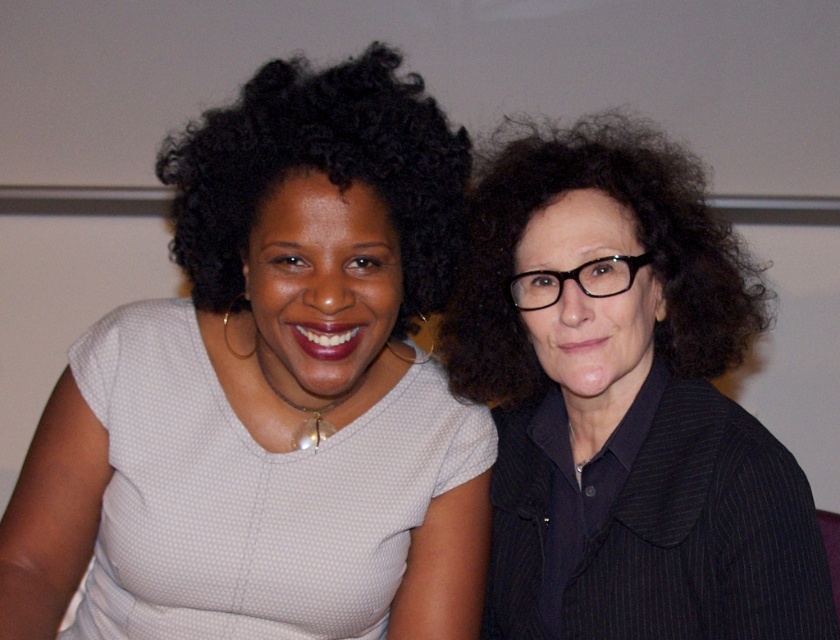
Is matte white blouse at center further to the viewer compared to black pinstriped blazer at right?

No, matte white blouse at center is in front of black pinstriped blazer at right.

Which is in front, point (403, 106) or point (722, 404)?

Point (403, 106) is in front.

At what (x,y) coordinates should I click in order to perform the action: click on matte white blouse at center. Please return your answer as a coordinate pair (x, y). The image size is (840, 640). Looking at the image, I should click on (271, 394).

Who is positioned more to the left, curly dark brown hair at right or black curly hair at upper left?

black curly hair at upper left

Can you confirm if curly dark brown hair at right is smaller than black curly hair at upper left?

No.

The width and height of the screenshot is (840, 640). Find the location of `curly dark brown hair at right`. curly dark brown hair at right is located at coordinates (638, 237).

Is matte white blouse at center behind black curly hair at upper left?

Yes, it is behind black curly hair at upper left.

Between matte white blouse at center and black curly hair at upper left, which one appears on the right side from the viewer's perspective?

Positioned to the right is matte white blouse at center.

Who is more forward, (437, 410) or (227, 132)?

Point (227, 132) is more forward.

The image size is (840, 640). Identify the location of matte white blouse at center. (271, 394).